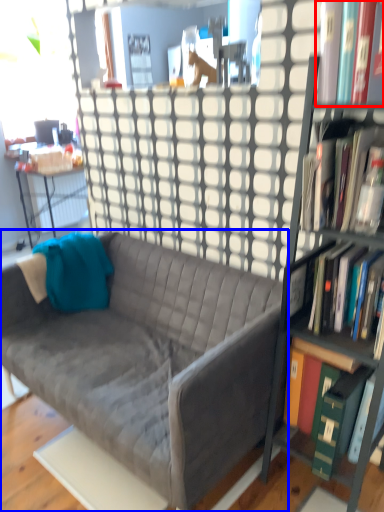
Question: Which object appears closest to the camera in this image, book (highlighted by a red box) or studio couch (highlighted by a blue box)?

Choices:
 (A) book
 (B) studio couch

Answer: (A)